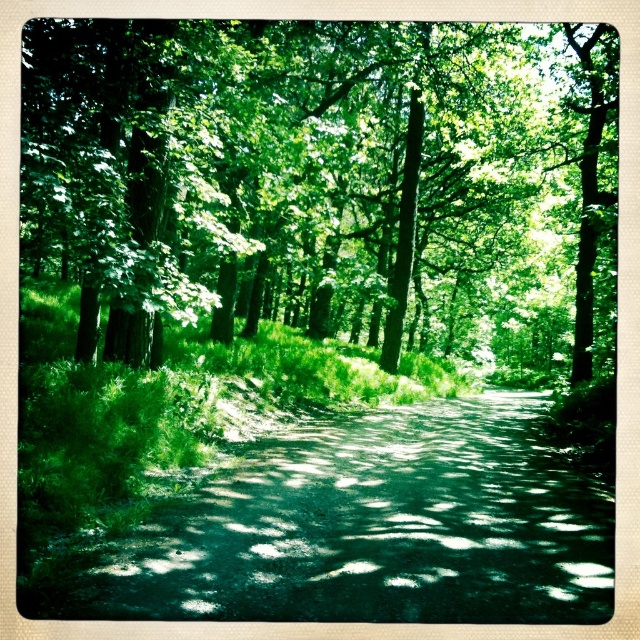
You are navigating through the forest and want to move from the point at coordinates point (44, 67) to the point at coordinates point (566, 483). Which direction should you move relative to your current position?

You should move away from your current position towards the point at coordinates point (566, 483) since it is further away from you compared to the point at coordinates point (44, 67).

In the scene shown: You are a hiker trying to navigate through the forest. You see the green leafy tree at upper center and the dark green asphalt at center. Which object is taller?

The green leafy tree at upper center is much taller than the dark green asphalt at center.